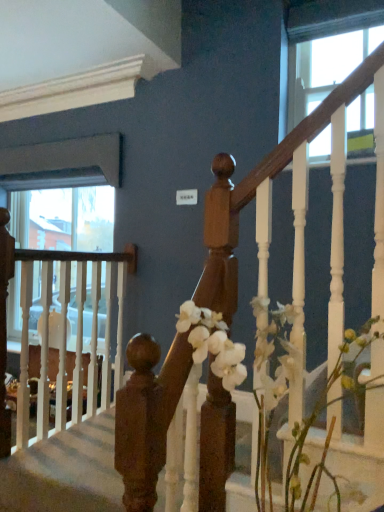
Question: Is clear glass window at upper right in contact with wooden handrail at center?

Choices:
 (A) no
 (B) yes

Answer: (A)

Question: From the image's perspective, is clear glass window at upper right above wooden handrail at center?

Choices:
 (A) no
 (B) yes

Answer: (B)

Question: Considering the relative sizes of clear glass window at upper right and wooden handrail at center in the image provided, is clear glass window at upper right thinner than wooden handrail at center?

Choices:
 (A) yes
 (B) no

Answer: (A)

Question: Does clear glass window at upper right have a greater width compared to wooden handrail at center?

Choices:
 (A) yes
 (B) no

Answer: (B)

Question: From a real-world perspective, does clear glass window at upper right sit lower than wooden handrail at center?

Choices:
 (A) yes
 (B) no

Answer: (B)

Question: From a real-world perspective, is wooden handrail at center physically located above or below white matte flowers at center?

Choices:
 (A) below
 (B) above

Answer: (A)

Question: Relative to white matte flowers at center, is wooden handrail at center in front or behind?

Choices:
 (A) behind
 (B) front

Answer: (A)

Question: Based on their positions, is wooden handrail at center located to the left or right of white matte flowers at center?

Choices:
 (A) left
 (B) right

Answer: (A)

Question: Is wooden handrail at center wider or thinner than white matte flowers at center?

Choices:
 (A) wide
 (B) thin

Answer: (A)

Question: Considering the positions of white matte flowers at center and wooden handrail at center in the image, is white matte flowers at center wider or thinner than wooden handrail at center?

Choices:
 (A) thin
 (B) wide

Answer: (A)

Question: In terms of height, does white matte flowers at center look taller or shorter compared to wooden handrail at center?

Choices:
 (A) tall
 (B) short

Answer: (A)

Question: From the image's perspective, is white matte flowers at center located above or below wooden handrail at center?

Choices:
 (A) above
 (B) below

Answer: (A)

Question: Considering the positions of point (188, 307) and point (112, 450), is point (188, 307) closer or farther from the camera than point (112, 450)?

Choices:
 (A) closer
 (B) farther

Answer: (A)

Question: Considering the positions of wooden handrail at center and clear glass window at upper right in the image, is wooden handrail at center taller or shorter than clear glass window at upper right?

Choices:
 (A) short
 (B) tall

Answer: (A)

Question: Does point (91, 499) appear closer or farther from the camera than point (367, 15)?

Choices:
 (A) farther
 (B) closer

Answer: (B)